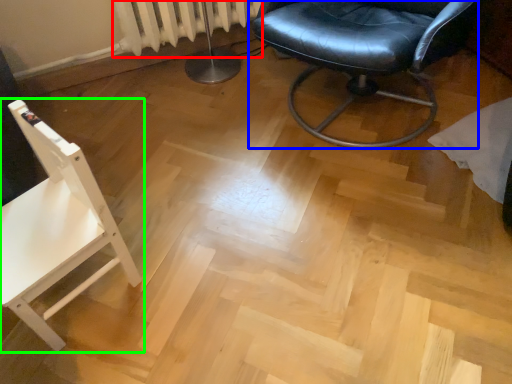
Question: Based on their relative distances, which object is nearer to radiator (highlighted by a red box)? Choose from chair (highlighted by a blue box) and chair (highlighted by a green box).

Choices:
 (A) chair
 (B) chair

Answer: (A)